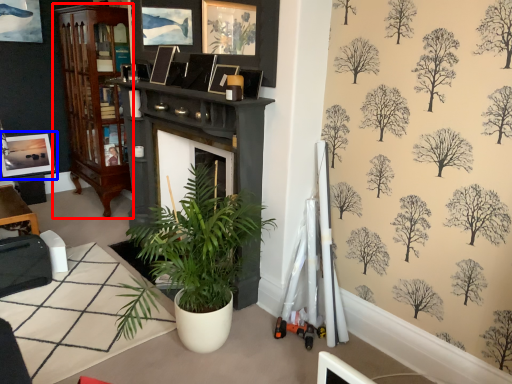
Question: Which object is further to the camera taking this photo, cabinetry (highlighted by a red box) or picture frame (highlighted by a blue box)?

Choices:
 (A) cabinetry
 (B) picture frame

Answer: (B)